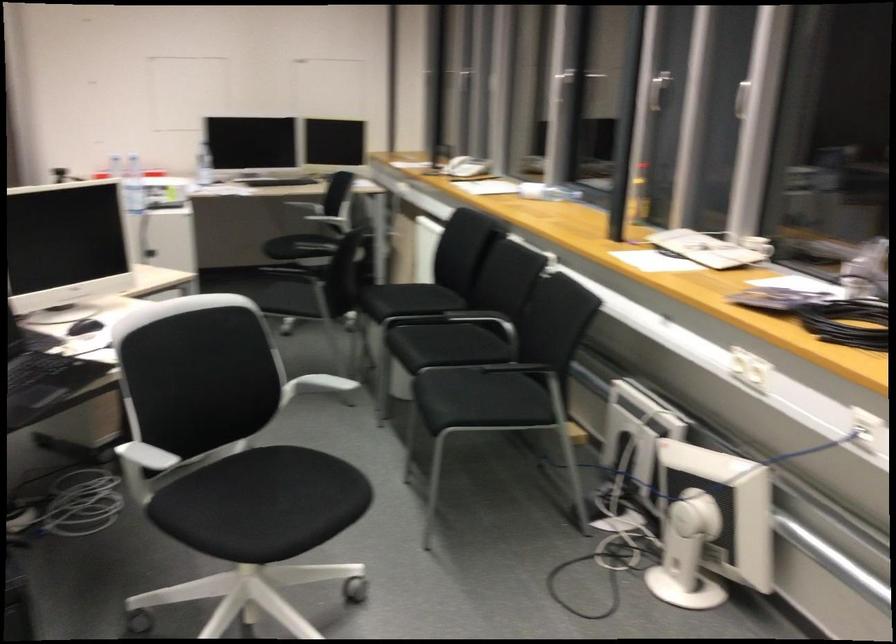
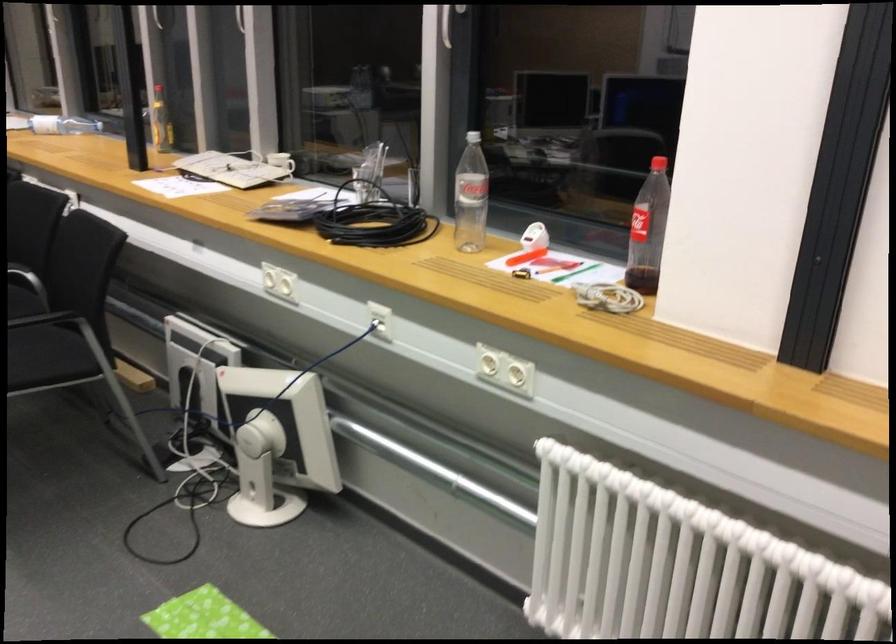
In the second image, find the point that corresponds to [712,532] in the first image.

(277, 442)